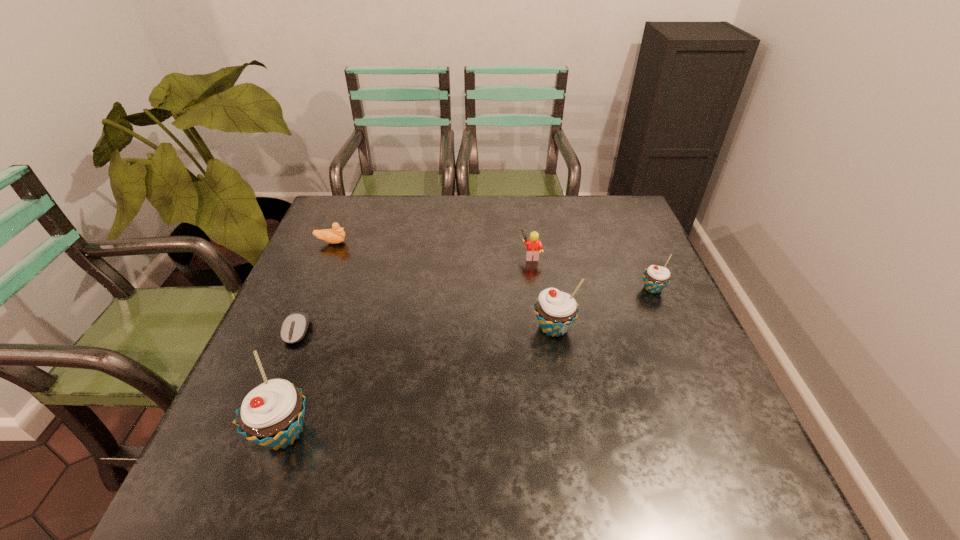
Identify the location of duckling at the left edge. (336, 235).

You are a GUI agent. You are given a task and a screenshot of the screen. Output one action in this format:
    pyautogui.click(x=<x>, y=<y>)
    Task: Click on the computer equipment that is at the left edge
    
    Given the screenshot: What is the action you would take?
    [294, 327]

This screenshot has height=540, width=960. Identify the location of object that is at the right edge. (656, 278).

The height and width of the screenshot is (540, 960). I want to click on object that is at the near left corner, so click(x=271, y=415).

The image size is (960, 540). Identify the location of free space at the far edge of the desktop. (453, 210).

You are a GUI agent. You are given a task and a screenshot of the screen. Output one action in this format:
    pyautogui.click(x=<x>, y=<y>)
    Task: Click on the vacant space at the near edge of the desktop
    The height and width of the screenshot is (540, 960).
    Given the screenshot: What is the action you would take?
    pyautogui.click(x=388, y=406)

This screenshot has width=960, height=540. In the image, there is a desktop. Find the location of `blank space at the left edge`. blank space at the left edge is located at coordinates (344, 299).

Locate an element on the screen. The width and height of the screenshot is (960, 540). blank space at the right edge of the desktop is located at coordinates (673, 319).

This screenshot has width=960, height=540. Find the location of `vacant space at the far right corner of the desktop`. vacant space at the far right corner of the desktop is located at coordinates (634, 237).

In the image, there is a desktop. Where is `free region at the near right corner`? The height and width of the screenshot is (540, 960). free region at the near right corner is located at coordinates (658, 436).